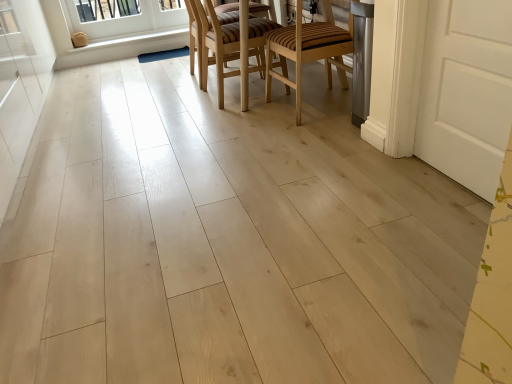
Question: Is white wood window at upper left taller than white painted wood at upper left?

Choices:
 (A) no
 (B) yes

Answer: (B)

Question: Is white wood window at upper left further to camera compared to white painted wood at upper left?

Choices:
 (A) no
 (B) yes

Answer: (B)

Question: Is white wood window at upper left not inside white painted wood at upper left?

Choices:
 (A) yes
 (B) no

Answer: (A)

Question: Is white wood window at upper left touching white painted wood at upper left?

Choices:
 (A) no
 (B) yes

Answer: (A)

Question: Could you tell me if white wood window at upper left is turned towards white painted wood at upper left?

Choices:
 (A) no
 (B) yes

Answer: (A)

Question: Is white wood screen door at left bigger or smaller than white wood window at upper left?

Choices:
 (A) small
 (B) big

Answer: (B)

Question: Would you say white wood screen door at left is to the left or to the right of white wood window at upper left in the picture?

Choices:
 (A) right
 (B) left

Answer: (B)

Question: Would you say white wood screen door at left is inside or outside white wood window at upper left?

Choices:
 (A) outside
 (B) inside

Answer: (A)

Question: From a real-world perspective, is white wood screen door at left positioned above or below white wood window at upper left?

Choices:
 (A) above
 (B) below

Answer: (B)

Question: In terms of size, does white wood screen door at left appear bigger or smaller than wooden chair at center, which is the first chair in left-to-right order?

Choices:
 (A) big
 (B) small

Answer: (A)

Question: In the image, is white wood screen door at left on the left side or the right side of wooden chair at center, which is the first chair in left-to-right order?

Choices:
 (A) left
 (B) right

Answer: (A)

Question: Is white wood screen door at left wider or thinner than wooden chair at center, which is the 2th chair from right to left?

Choices:
 (A) wide
 (B) thin

Answer: (A)

Question: Is white wood screen door at left inside the boundaries of wooden chair at center, which is the 2th chair from right to left, or outside?

Choices:
 (A) inside
 (B) outside

Answer: (B)

Question: Considering the relative positions of white wood window at upper left and wooden striped chair at center, which ranks as the 1th chair in right-to-left order, in the image provided, is white wood window at upper left to the left or to the right of wooden striped chair at center, which ranks as the 1th chair in right-to-left order,?

Choices:
 (A) left
 (B) right

Answer: (A)

Question: Considering the positions of white wood window at upper left and wooden striped chair at center, which ranks as the 1th chair in right-to-left order, in the image, is white wood window at upper left bigger or smaller than wooden striped chair at center, which ranks as the 1th chair in right-to-left order,?

Choices:
 (A) small
 (B) big

Answer: (A)